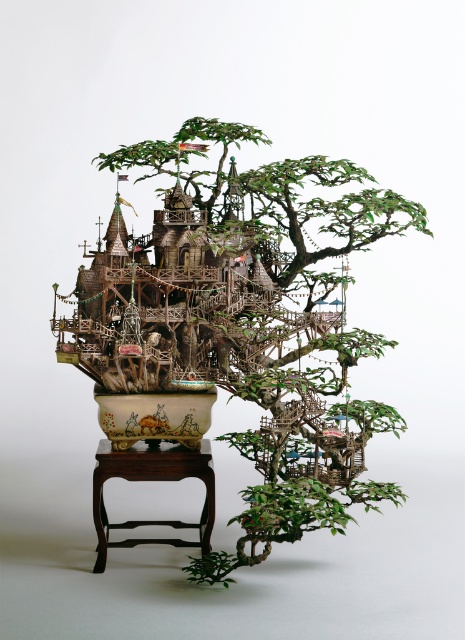
Question: Is green matte tree at center positioned behind brown wood stool at lower center?

Choices:
 (A) no
 (B) yes

Answer: (A)

Question: Can you confirm if green matte tree at center is smaller than brown wood stool at lower center?

Choices:
 (A) yes
 (B) no

Answer: (B)

Question: Does green matte tree at center appear under brown wood stool at lower center?

Choices:
 (A) yes
 (B) no

Answer: (B)

Question: Which of the following is the closest to the observer?

Choices:
 (A) green matte tree at center
 (B) brown wood stool at lower center

Answer: (A)

Question: Among these objects, which one is farthest from the camera?

Choices:
 (A) green matte tree at center
 (B) brown wood stool at lower center

Answer: (B)

Question: Which of the following is the farthest from the observer?

Choices:
 (A) green matte tree at center
 (B) brown wood stool at lower center

Answer: (B)